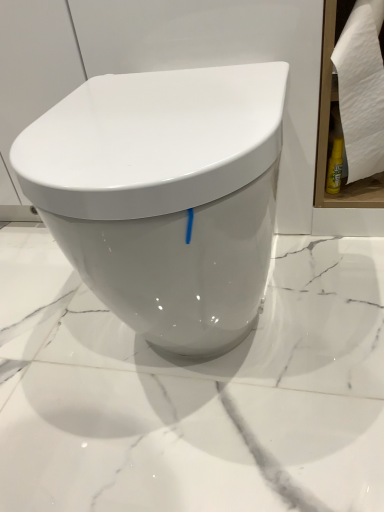
This screenshot has width=384, height=512. What are the coordinates of `empty space that is ontop of white glossy toilet at center` in the screenshot? It's located at (169, 104).